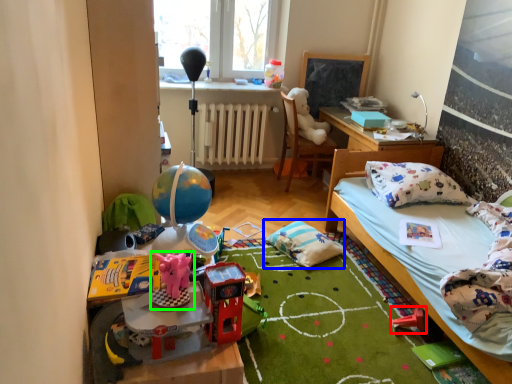
Question: Based on their relative distances, which object is farther from toy (highlighted by a red box)? Choose from pillow (highlighted by a blue box) and toy (highlighted by a green box).

Choices:
 (A) pillow
 (B) toy

Answer: (B)